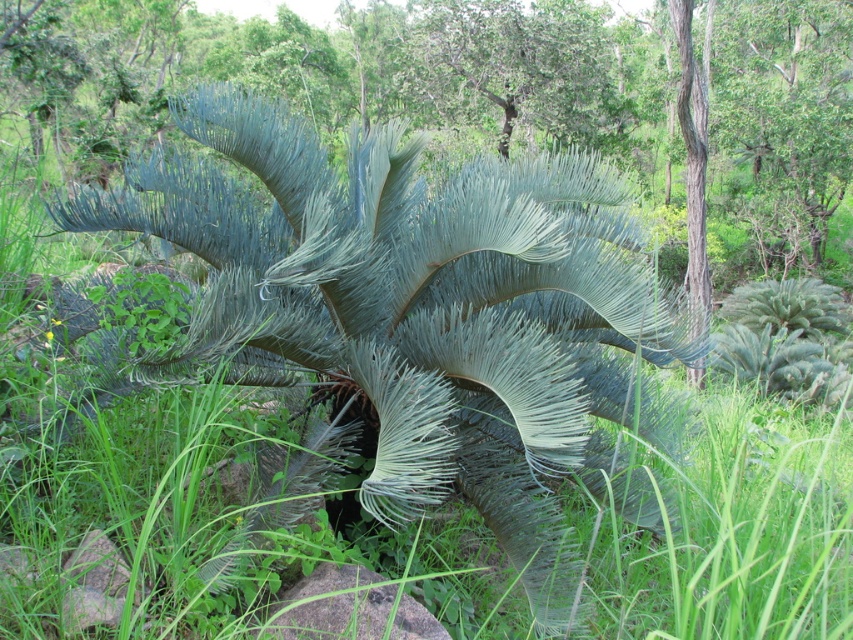
Question: Considering the relative positions of green fibrous fern at center and gray rock at center in the image provided, where is green fibrous fern at center located with respect to gray rock at center?

Choices:
 (A) above
 (B) below

Answer: (A)

Question: Which point is closer to the camera?

Choices:
 (A) (331, 356)
 (B) (410, 609)

Answer: (B)

Question: Is green fibrous fern at center below gray rock at center?

Choices:
 (A) yes
 (B) no

Answer: (B)

Question: Is green fibrous fern at center wider than gray rock at center?

Choices:
 (A) no
 (B) yes

Answer: (B)

Question: Among these objects, which one is farthest from the camera?

Choices:
 (A) green fibrous fern at center
 (B) gray rock at center

Answer: (A)